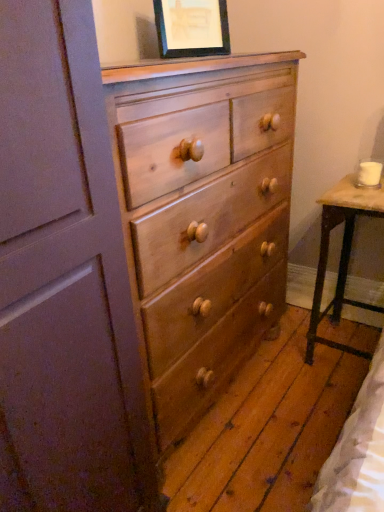
Question: Can you confirm if matte black picture frame at upper center is thinner than light brown wood chest of drawers at center?

Choices:
 (A) yes
 (B) no

Answer: (A)

Question: Is matte black picture frame at upper center in front of light brown wood chest of drawers at center?

Choices:
 (A) yes
 (B) no

Answer: (B)

Question: From a real-world perspective, is matte black picture frame at upper center on top of light brown wood chest of drawers at center?

Choices:
 (A) yes
 (B) no

Answer: (A)

Question: Is matte black picture frame at upper center positioned with its back to light brown wood chest of drawers at center?

Choices:
 (A) yes
 (B) no

Answer: (B)

Question: Can you confirm if matte black picture frame at upper center is taller than light brown wood chest of drawers at center?

Choices:
 (A) yes
 (B) no

Answer: (B)

Question: From a real-world perspective, is matte black picture frame at upper center beneath light brown wood chest of drawers at center?

Choices:
 (A) no
 (B) yes

Answer: (A)

Question: Does light brown wood chest of drawers at center have a lesser width compared to matte black picture frame at upper center?

Choices:
 (A) yes
 (B) no

Answer: (B)

Question: Can we say light brown wood chest of drawers at center lies outside matte black picture frame at upper center?

Choices:
 (A) yes
 (B) no

Answer: (A)

Question: Is the depth of light brown wood chest of drawers at center greater than that of matte black picture frame at upper center?

Choices:
 (A) yes
 (B) no

Answer: (B)

Question: Would you say light brown wood chest of drawers at center is a long distance from matte black picture frame at upper center?

Choices:
 (A) no
 (B) yes

Answer: (A)

Question: Can you confirm if light brown wood chest of drawers at center is taller than matte black picture frame at upper center?

Choices:
 (A) yes
 (B) no

Answer: (A)

Question: Is matte black picture frame at upper center inside light brown wood chest of drawers at center?

Choices:
 (A) no
 (B) yes

Answer: (A)

Question: Considering the relative sizes of matte black picture frame at upper center and wooden table at right in the image provided, is matte black picture frame at upper center thinner than wooden table at right?

Choices:
 (A) no
 (B) yes

Answer: (B)